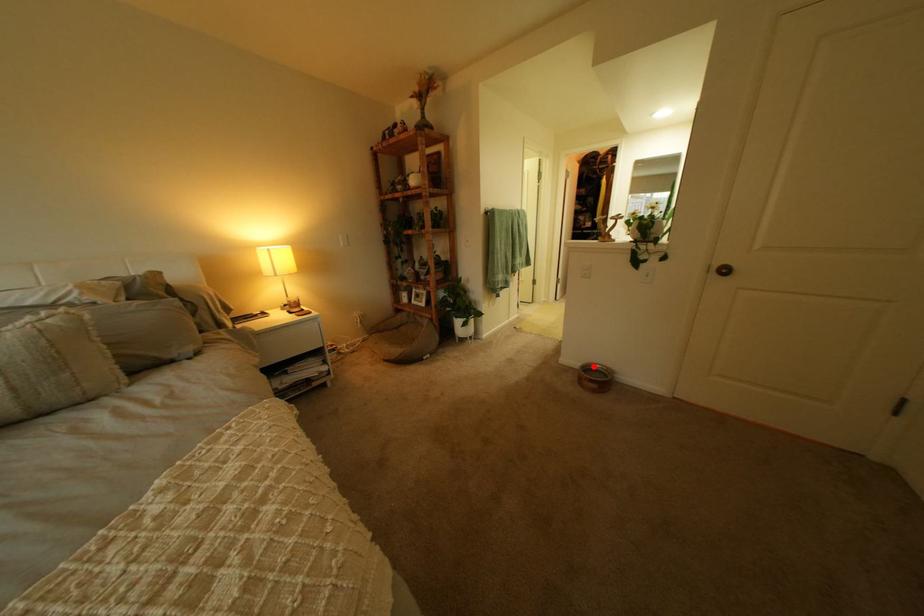
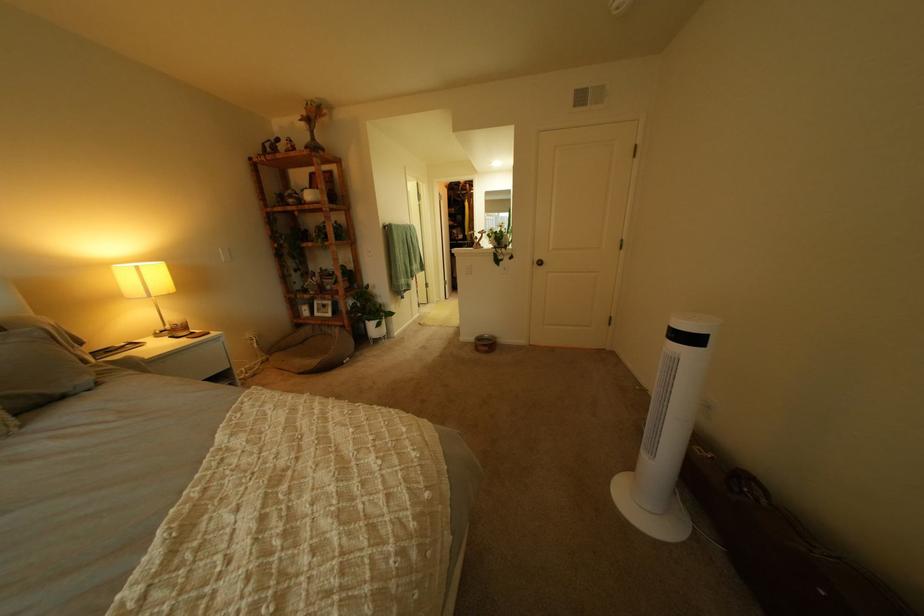
Question: I am providing you with two images of the same scene from different viewpoints. Given a red point in image1, look at the same physical point in image2. Is it:

Choices:
 (A) Closer to the viewpoint
 (B) Farther from the viewpoint

Answer: (B)